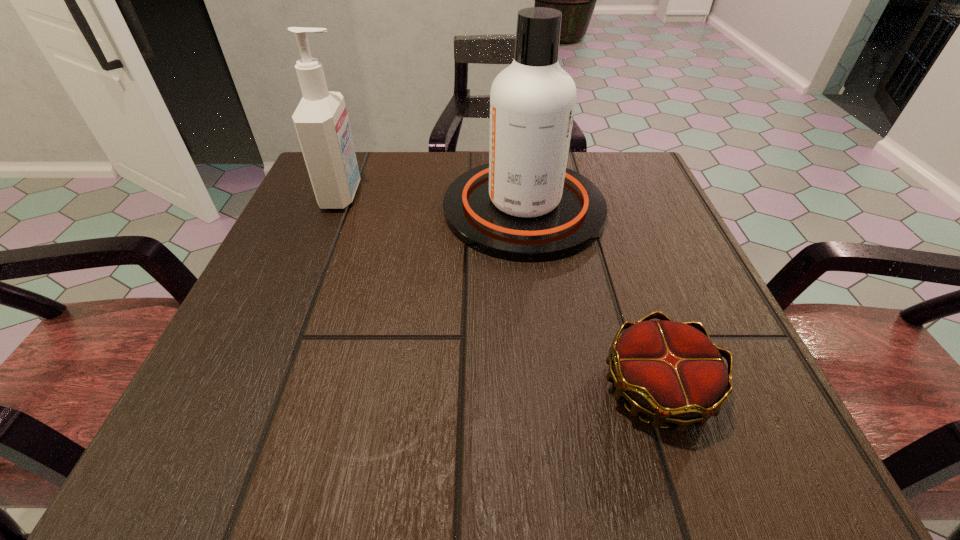
I want to click on crown present at the right edge, so click(671, 371).

The height and width of the screenshot is (540, 960). Find the location of `object that is at the far left corner`. object that is at the far left corner is located at coordinates (321, 122).

Identify the location of object present at the far right corner. (524, 205).

This screenshot has width=960, height=540. Identify the location of object present at the near right corner. (671, 371).

Locate an element on the screen. The height and width of the screenshot is (540, 960). vacant space at the far edge of the desktop is located at coordinates (420, 155).

You are a GUI agent. You are given a task and a screenshot of the screen. Output one action in this format:
    pyautogui.click(x=<x>, y=<y>)
    Task: Click on the free spot at the near edge of the desktop
    
    Given the screenshot: What is the action you would take?
    pyautogui.click(x=608, y=436)

Locate an element on the screen. Image resolution: width=960 pixels, height=540 pixels. vacant space at the left edge is located at coordinates (288, 328).

This screenshot has height=540, width=960. I want to click on vacant space at the right edge of the desktop, so click(631, 251).

Where is `vacant space at the far right corner`? This screenshot has height=540, width=960. vacant space at the far right corner is located at coordinates (592, 154).

Where is `free space between the leftmost object and the right cleansing agent`? This screenshot has height=540, width=960. free space between the leftmost object and the right cleansing agent is located at coordinates (433, 202).